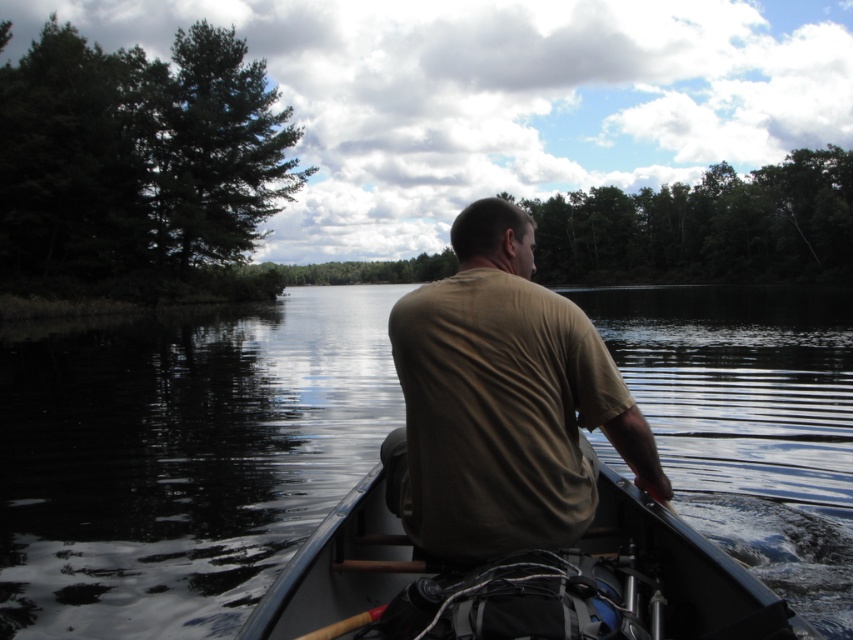
Image resolution: width=853 pixels, height=640 pixels. What do you see at coordinates (181, 458) in the screenshot?
I see `black water at center` at bounding box center [181, 458].

Does point (62, 417) lie in front of point (601, 547)?

No, (62, 417) is further to viewer.

Is point (360, 308) closer to camera compared to point (677, 536)?

No.

Identify the location of black water at center. (181, 458).

Does black water at center appear over tan cotton shirt at center?

Indeed, black water at center is positioned over tan cotton shirt at center.

Between point (16, 369) and point (546, 467), which one is positioned behind?

The point (16, 369) is more distant.

Locate an element on the screen. The image size is (853, 640). black water at center is located at coordinates (181, 458).

Who is lower down, tan cotton shirt at center or gray plastic canoe at center?

Positioned lower is gray plastic canoe at center.

Is tan cotton shirt at center to the right of gray plastic canoe at center from the viewer's perspective?

Yes, tan cotton shirt at center is to the right of gray plastic canoe at center.

This screenshot has height=640, width=853. Find the location of `tan cotton shirt at center`. tan cotton shirt at center is located at coordinates coord(505,401).